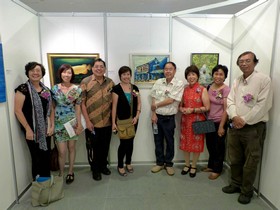
Find the location of `floor in front of people`. floor in front of people is located at coordinates (136, 193).